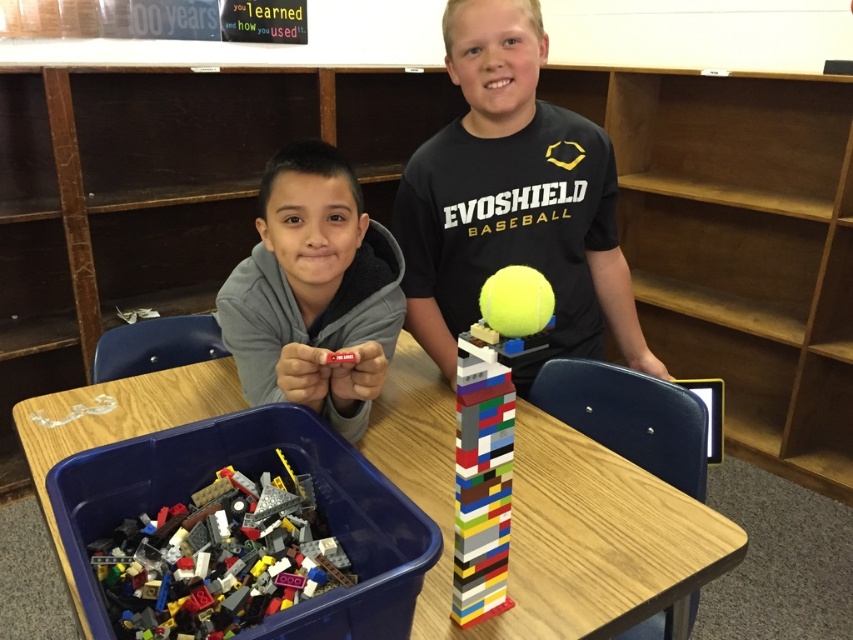
Question: Which of the following is the farthest from the observer?

Choices:
 (A) gray matte hoodie at center
 (B) wooden table at center

Answer: (A)

Question: Observing the image, what is the correct spatial positioning of wooden table at center in reference to multicolored plastic tower at center?

Choices:
 (A) left
 (B) right

Answer: (A)

Question: Among these points, which one is nearest to the camera?

Choices:
 (A) (292, 276)
 (B) (466, 577)
 (C) (608, 330)

Answer: (B)

Question: Does matte black shirt at center appear on the left side of gray matte hoodie at center?

Choices:
 (A) yes
 (B) no

Answer: (B)

Question: Which of these objects is positioned farthest from the matte black shirt at center?

Choices:
 (A) gray matte hoodie at center
 (B) wooden table at center

Answer: (B)

Question: Is matte black shirt at center thinner than multicolored plastic tower at center?

Choices:
 (A) yes
 (B) no

Answer: (B)